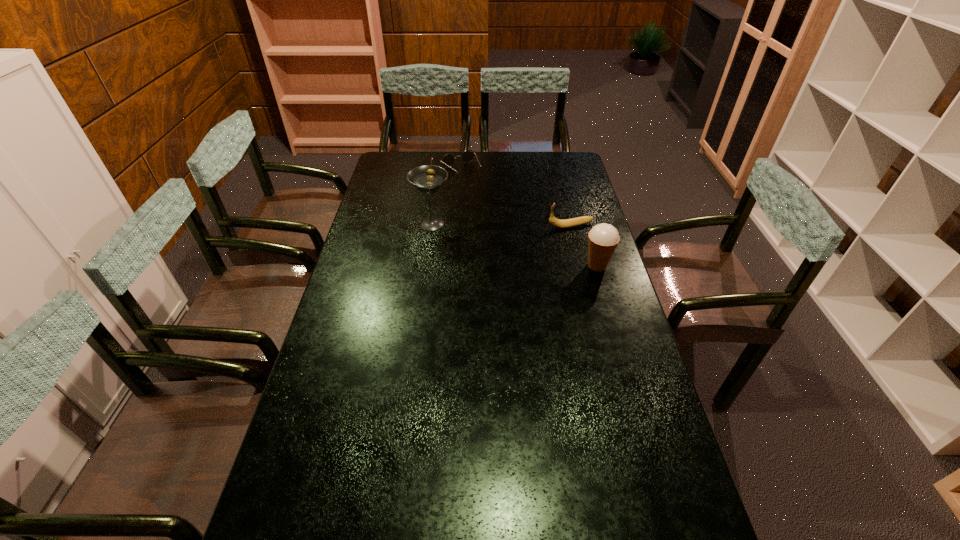
Locate an element on the screen. The width and height of the screenshot is (960, 540). free space on the desktop that is between the tallest object and the third shortest object and is positioned at the stem of the second shortest object is located at coordinates (487, 238).

Find the location of a particular element. Image resolution: width=960 pixels, height=540 pixels. vacant spot on the desktop that is between the tallest object and the icecream and is positioned on the front-facing side of the farthest object is located at coordinates (531, 249).